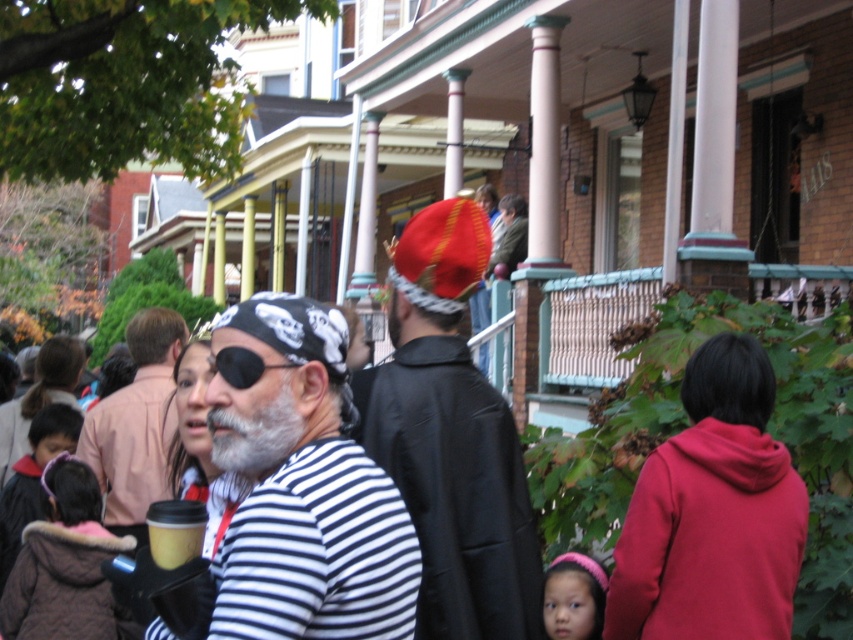
Question: Which object is farther from the camera taking this photo?

Choices:
 (A) brown fuzzy coat at lower left
 (B) striped fabric pirate at center
 (C) pink fuzzy headband at lower right
 (D) black striped shirt at center

Answer: (B)

Question: Can you confirm if striped fabric pirate at center is positioned above velvet black coat at lower left?

Choices:
 (A) yes
 (B) no

Answer: (A)

Question: Can you confirm if black striped shirt at center is positioned below shiny red fabric hat at center?

Choices:
 (A) no
 (B) yes

Answer: (B)

Question: Can you confirm if matte red hoodie at lower right is positioned to the right of velvet black coat at lower left?

Choices:
 (A) no
 (B) yes

Answer: (B)

Question: Among these objects, which one is nearest to the camera?

Choices:
 (A) striped fabric pirate at center
 (B) pink fuzzy headband at lower right
 (C) brown fuzzy coat at lower left
 (D) shiny red fabric hat at center

Answer: (D)

Question: Which point appears farthest from the camera in this image?

Choices:
 (A) [225, 410]
 (B) [519, 554]
 (C) [15, 525]

Answer: (C)